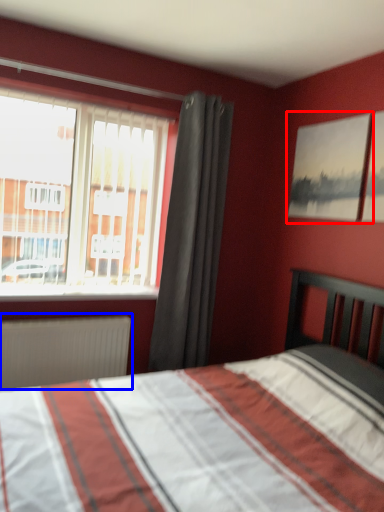
Question: Among these objects, which one is farthest to the camera, picture frame (highlighted by a red box) or radiator (highlighted by a blue box)?

Choices:
 (A) picture frame
 (B) radiator

Answer: (B)